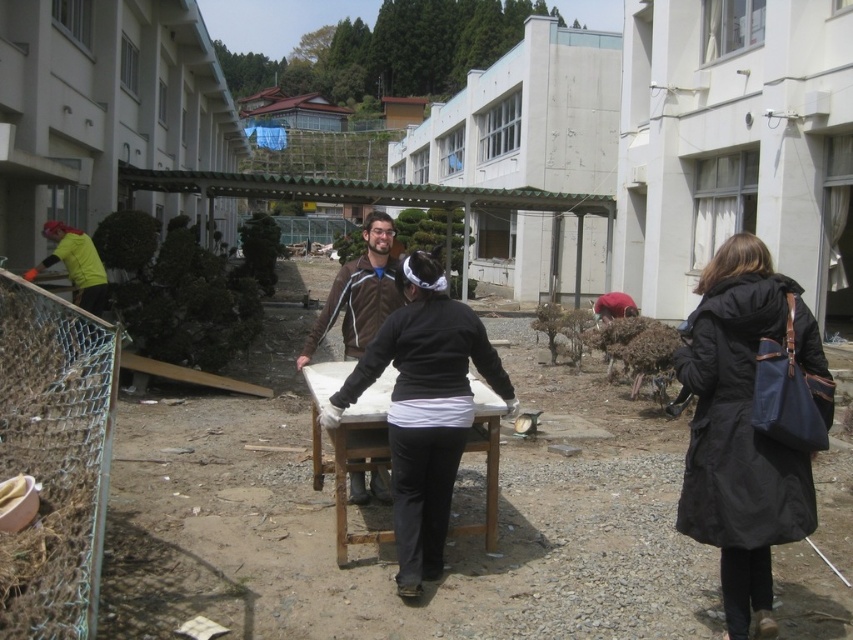
Question: Can you confirm if black fabric coat at right is positioned below brown leather jacket at center?

Choices:
 (A) no
 (B) yes

Answer: (B)

Question: Can you confirm if brown leather jacket at center is positioned above yellow-green fabric at left?

Choices:
 (A) yes
 (B) no

Answer: (B)

Question: Estimate the real-world distances between objects in this image. Which object is farther from the yellow-green fabric at left?

Choices:
 (A) brown leather jacket at center
 (B) black fabric coat at right
 (C) black matte jacket at center

Answer: (B)

Question: Which object is closer to the camera taking this photo?

Choices:
 (A) black fabric coat at right
 (B) black matte jacket at center

Answer: (A)

Question: Which of the following is the farthest from the observer?

Choices:
 (A) (416, 570)
 (B) (801, 333)
 (C) (376, 497)

Answer: (C)

Question: Where is black fabric coat at right located in relation to yellow-green fabric at left in the image?

Choices:
 (A) below
 (B) above

Answer: (A)